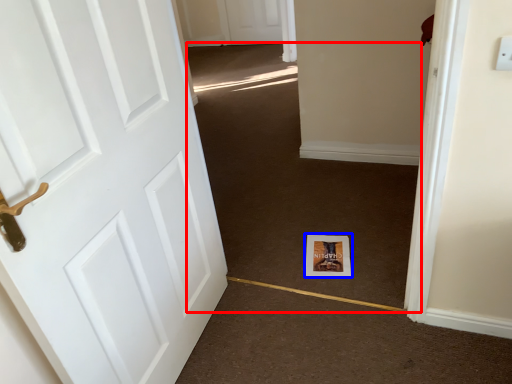
Question: Which object is further to the camera taking this photo, plain (highlighted by a red box) or print (highlighted by a blue box)?

Choices:
 (A) plain
 (B) print

Answer: (B)